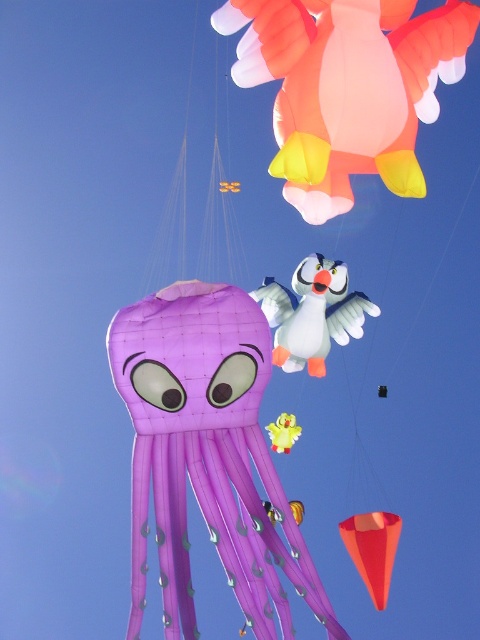
Is matte purple octopus at center wider than matte orange duck at upper center?

No.

Is point (156, 442) farther from camera compared to point (299, 74)?

No, (156, 442) is closer to viewer.

Who is more forward, (240,440) or (298,172)?

Point (240,440) is more forward.

This screenshot has height=640, width=480. In order to click on matte purple octopus at center in this screenshot , I will do `click(205, 454)`.

Is the position of matte orange duck at upper center less distant than that of matte orange cone at lower right?

Yes, matte orange duck at upper center is in front of matte orange cone at lower right.

Can you confirm if matte orange duck at upper center is taller than matte orange cone at lower right?

Indeed, matte orange duck at upper center has a greater height compared to matte orange cone at lower right.

Find the location of a particular element. This screenshot has height=640, width=480. matte orange duck at upper center is located at coordinates (348, 88).

Between matte purple octopus at center and matte orange cone at lower right, which one has less height?

matte orange cone at lower right

You are a GUI agent. You are given a task and a screenshot of the screen. Output one action in this format:
    pyautogui.click(x=<x>, y=<y>)
    Task: Click on the matte purple octopus at center
    
    Given the screenshot: What is the action you would take?
    pyautogui.click(x=205, y=454)

Locate an element on the screen. matte purple octopus at center is located at coordinates (205, 454).